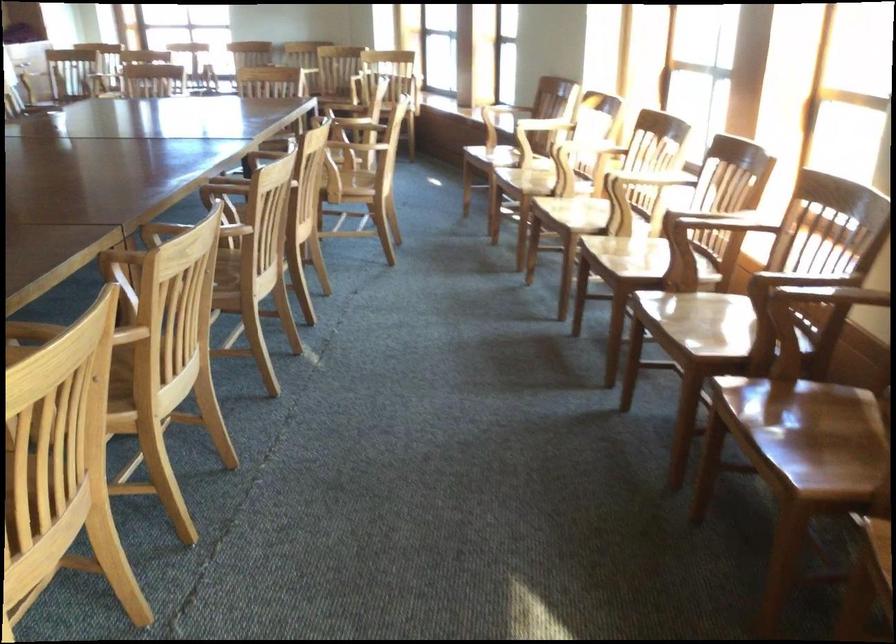
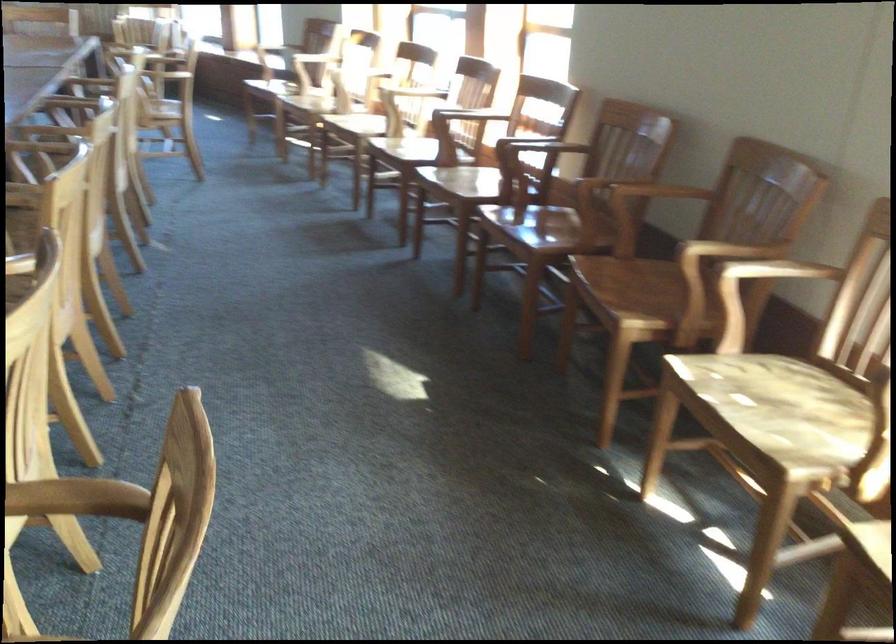
In the second image, find the point that corresponds to (543,109) in the first image.

(312, 58)